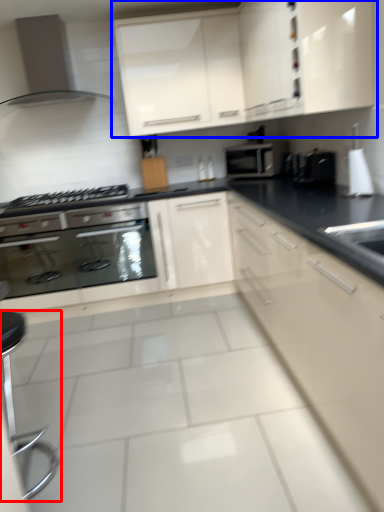
Question: Which point is closer to the camera, bar stool (highlighted by a red box) or cabinetry (highlighted by a blue box)?

Choices:
 (A) bar stool
 (B) cabinetry

Answer: (A)